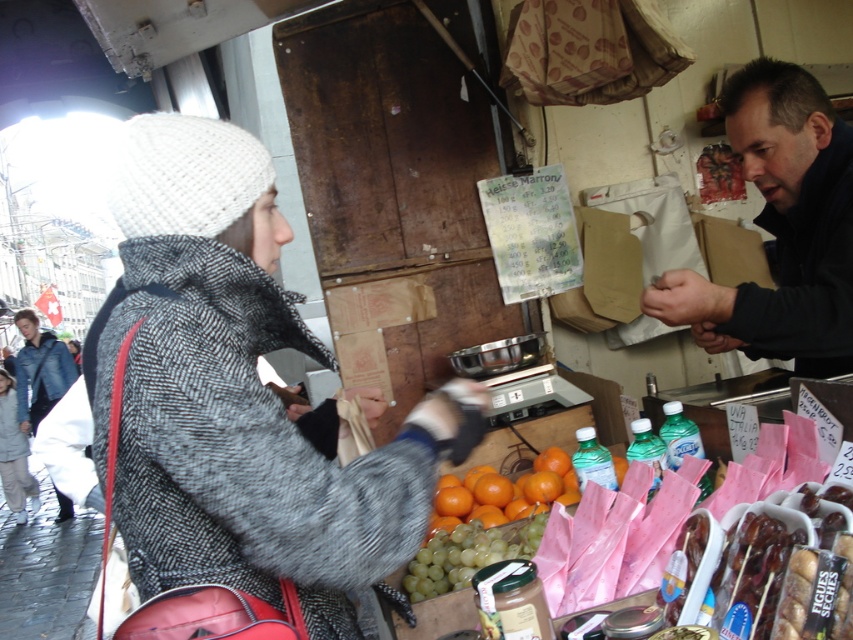
Question: Is dark blue jacket at upper right further to camera compared to denim jacket at left?

Choices:
 (A) yes
 (B) no

Answer: (B)

Question: Is knitted wool hat at upper left thinner than dark blue jacket at upper right?

Choices:
 (A) yes
 (B) no

Answer: (B)

Question: Among these points, which one is farthest from the camera?

Choices:
 (A) 48,378
 (B) 392,536

Answer: (A)

Question: From the image, what is the correct spatial relationship of dark blue jacket at upper right in relation to denim jacket at left?

Choices:
 (A) right
 (B) left

Answer: (A)

Question: Which point is closer to the camera?

Choices:
 (A) denim jacket at left
 (B) knitted wool hat at upper left

Answer: (B)

Question: Among these points, which one is farthest from the camera?

Choices:
 (A) (30, 349)
 (B) (123, 396)
 (C) (714, 308)

Answer: (A)